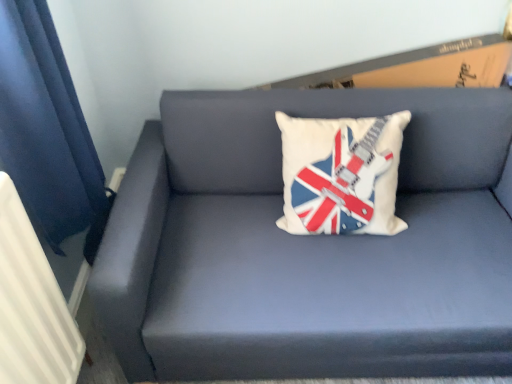
Question: Would you say matte blue couch at center is part of white fabric pillow with guitar and flag design at center's contents?

Choices:
 (A) yes
 (B) no

Answer: (B)

Question: From the image's perspective, is white fabric pillow with guitar and flag design at center on matte blue couch at center?

Choices:
 (A) yes
 (B) no

Answer: (A)

Question: Is matte blue couch at center at the back of white fabric pillow with guitar and flag design at center?

Choices:
 (A) yes
 (B) no

Answer: (A)

Question: From the image's perspective, is white fabric pillow with guitar and flag design at center beneath matte blue couch at center?

Choices:
 (A) no
 (B) yes

Answer: (A)

Question: From a real-world perspective, is white fabric pillow with guitar and flag design at center physically below matte blue couch at center?

Choices:
 (A) yes
 (B) no

Answer: (B)

Question: Considering the relative sizes of white fabric pillow with guitar and flag design at center and matte blue couch at center in the image provided, is white fabric pillow with guitar and flag design at center smaller than matte blue couch at center?

Choices:
 (A) yes
 (B) no

Answer: (A)

Question: Does white fabric pillow with guitar and flag design at center have a greater height compared to white textured radiator at left?

Choices:
 (A) no
 (B) yes

Answer: (A)

Question: From a real-world perspective, is white fabric pillow with guitar and flag design at center on top of white textured radiator at left?

Choices:
 (A) no
 (B) yes

Answer: (B)

Question: Is white fabric pillow with guitar and flag design at center outside of white textured radiator at left?

Choices:
 (A) no
 (B) yes

Answer: (B)

Question: Is white fabric pillow with guitar and flag design at center not close to white textured radiator at left?

Choices:
 (A) yes
 (B) no

Answer: (B)

Question: Is white fabric pillow with guitar and flag design at center turned away from white textured radiator at left?

Choices:
 (A) yes
 (B) no

Answer: (B)

Question: Does white fabric pillow with guitar and flag design at center have a lesser height compared to white textured radiator at left?

Choices:
 (A) yes
 (B) no

Answer: (A)

Question: From a real-world perspective, is matte blue couch at center under white fabric pillow with guitar and flag design at center?

Choices:
 (A) no
 (B) yes

Answer: (B)